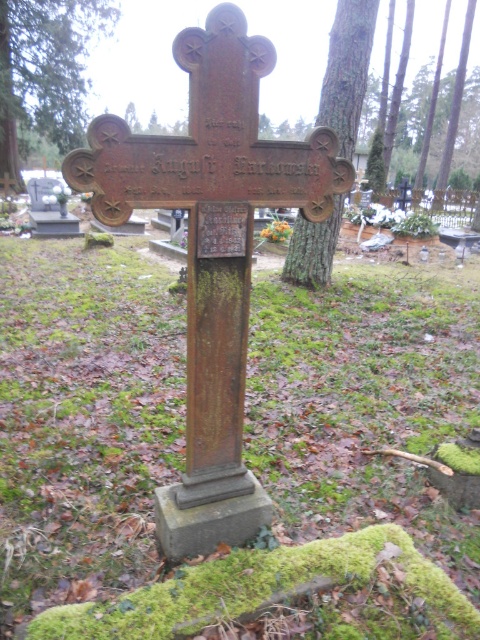
Can you confirm if green mossy tree at upper left is thinner than green bark tree at upper center?

In fact, green mossy tree at upper left might be wider than green bark tree at upper center.

Between point (35, 61) and point (383, 131), which one is positioned in front?

Point (383, 131) is more forward.

Locate an element on the screen. Image resolution: width=480 pixels, height=640 pixels. green mossy tree at upper left is located at coordinates (46, 68).

Describe the element at coordinates (46, 68) in the screenshot. Image resolution: width=480 pixels, height=640 pixels. I see `green mossy tree at upper left` at that location.

Does green mossy tree at upper left have a lesser width compared to smooth bark tree trunk at center?

No.

The width and height of the screenshot is (480, 640). Identify the location of green mossy tree at upper left. (46, 68).

Locate an element on the screen. The height and width of the screenshot is (640, 480). green mossy tree at upper left is located at coordinates (46, 68).

Is point (348, 88) in front of point (386, 131)?

Yes, point (348, 88) is in front of point (386, 131).

Between smooth bark tree trunk at center and green bark tree at upper center, which one appears on the left side from the viewer's perspective?

smooth bark tree trunk at center

Does point (295, 246) lie in front of point (458, 81)?

Yes, it is in front of point (458, 81).

Locate an element on the screen. smooth bark tree trunk at center is located at coordinates (347, 70).